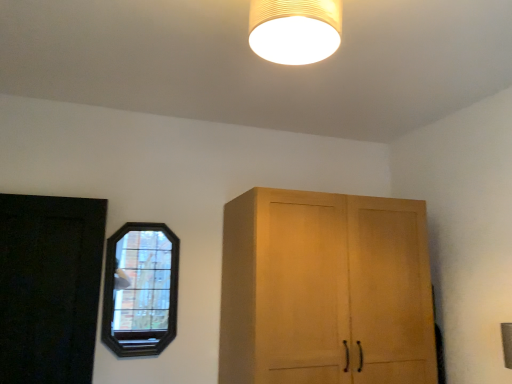
Question: Is point (154, 289) closer or farther from the camera than point (49, 279)?

Choices:
 (A) closer
 (B) farther

Answer: (B)

Question: Is dark wood stained window at left wider or thinner than black matte door at left?

Choices:
 (A) wide
 (B) thin

Answer: (B)

Question: Estimate the real-world distances between objects in this image. Which object is farther from the black matte door at left?

Choices:
 (A) dark wood stained window at left
 (B) matte beige lampshade at upper center

Answer: (B)

Question: Considering the real-world distances, which object is farthest from the dark wood stained window at left?

Choices:
 (A) black matte door at left
 (B) matte beige lampshade at upper center

Answer: (B)